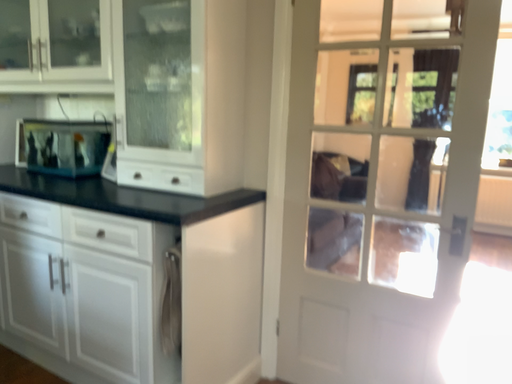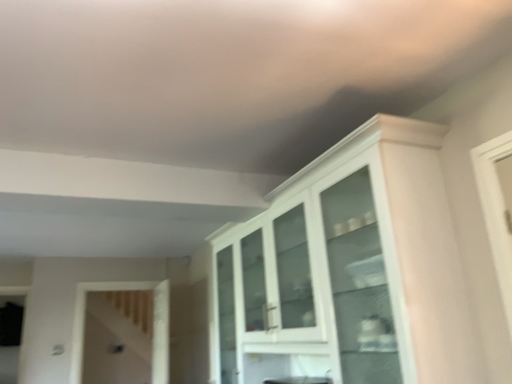
Question: How did the camera likely rotate when shooting the video?

Choices:
 (A) rotated right
 (B) rotated left

Answer: (B)